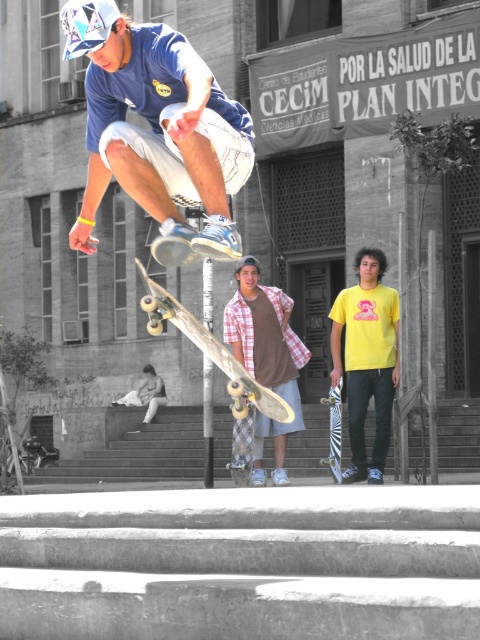
Does yellow matte shirt at center come in front of zebra-patterned skateboard at center?

Yes, it is.

Who is higher up, yellow matte shirt at center or zebra-patterned skateboard at center?

Positioned higher is yellow matte shirt at center.

Which is in front, point (334, 378) or point (328, 458)?

Point (334, 378) is in front.

The width and height of the screenshot is (480, 640). I want to click on yellow matte shirt at center, so click(367, 358).

Is point (277, 360) less distant than point (338, 428)?

Yes, point (277, 360) is in front of point (338, 428).

Is plaid shirt at center thinner than zebra-patterned skateboard at center?

No, plaid shirt at center is not thinner than zebra-patterned skateboard at center.

Where is `plaid shirt at center`? plaid shirt at center is located at coordinates (265, 356).

Who is positioned more to the left, matte blue shirt at upper center or wooden skateboard at center?

matte blue shirt at upper center

Is matte blue shirt at upper center smaller than wooden skateboard at center?

Yes.

Is point (104, 4) farther from viewer compared to point (238, 412)?

No, it is not.

Locate an element on the screen. The image size is (480, 640). matte blue shirt at upper center is located at coordinates (154, 128).